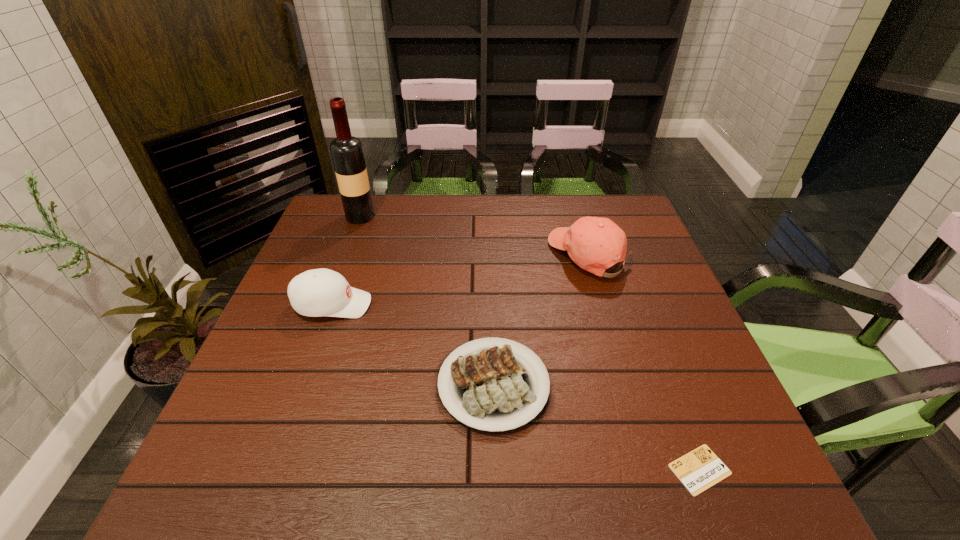
Locate an element on the screen. the farthest object is located at coordinates (346, 150).

Identify the location of wine bottle. (346, 150).

At what (x,y) coordinates should I click in order to perform the action: click on the right baseball cap. Please return your answer as a coordinate pair (x, y). The width and height of the screenshot is (960, 540). Looking at the image, I should click on (595, 244).

Find the location of `the taller baseball cap`. the taller baseball cap is located at coordinates (595, 244).

Where is `the third shortest object`? This screenshot has width=960, height=540. the third shortest object is located at coordinates (321, 292).

Identify the location of the nearer baseball cap. (321, 292).

Locate an element on the screen. the second shortest object is located at coordinates (490, 389).

Identify the location of plate. (490, 389).

I want to click on identity card, so click(698, 470).

Locate an element on the screen. the nearest object is located at coordinates (698, 470).